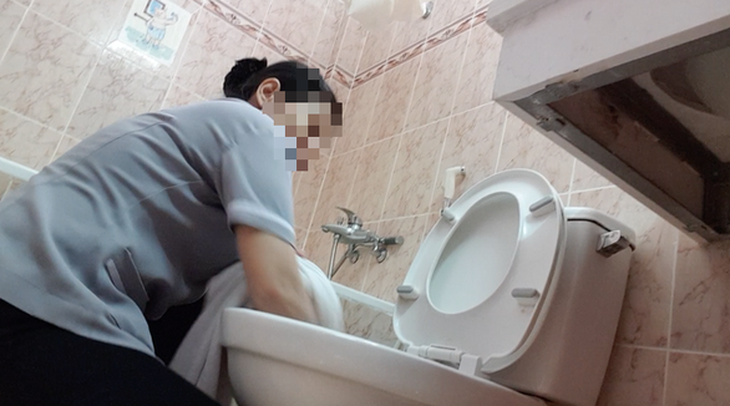
Find the location of a particular element. This screenshot has width=730, height=406. knob is located at coordinates (609, 251).